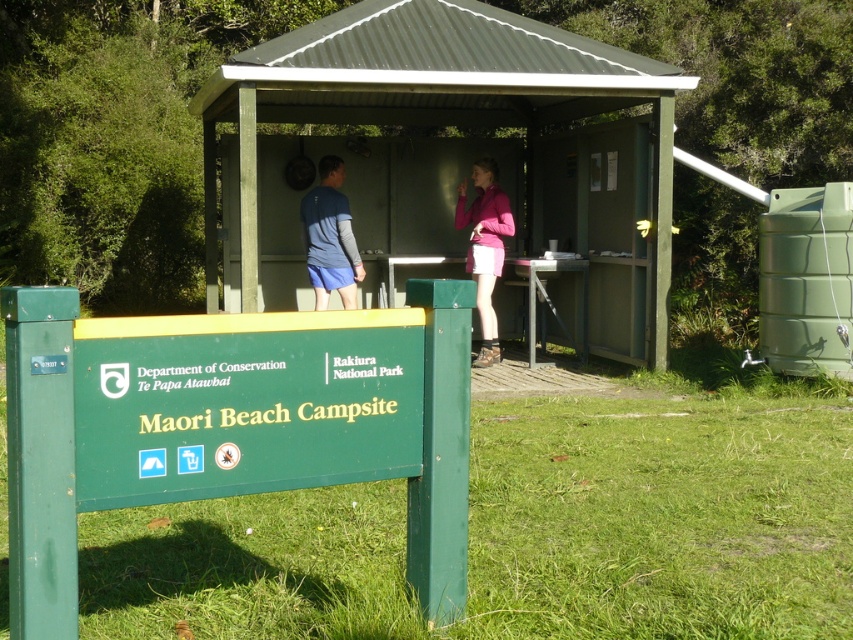
You are a GUI agent. You are given a task and a screenshot of the screen. Output one action in this format:
    pyautogui.click(x=<x>, y=<y>)
    Task: Click on the green wood hut at center
    This screenshot has height=640, width=853.
    Given the screenshot: What is the action you would take?
    pyautogui.click(x=434, y=100)

Where is `green wood hut at center`? Image resolution: width=853 pixels, height=640 pixels. green wood hut at center is located at coordinates (434, 100).

Can you confirm if green painted wood sign at lower left is shorter than pink matte skirt at center?

Yes, green painted wood sign at lower left is shorter than pink matte skirt at center.

Which is more to the left, green painted wood sign at lower left or pink matte skirt at center?

From the viewer's perspective, green painted wood sign at lower left appears more on the left side.

Is point (372, 362) positioned before point (459, 189)?

Yes, point (372, 362) is in front of point (459, 189).

Where is `green painted wood sign at lower left`? The width and height of the screenshot is (853, 640). green painted wood sign at lower left is located at coordinates (234, 422).

What do you see at coordinates (329, 237) in the screenshot? This screenshot has height=640, width=853. I see `matte blue shirt at center` at bounding box center [329, 237].

Is matte blue shirt at center shorter than pink matte skirt at center?

Correct, matte blue shirt at center is not as tall as pink matte skirt at center.

The width and height of the screenshot is (853, 640). I want to click on matte blue shirt at center, so click(x=329, y=237).